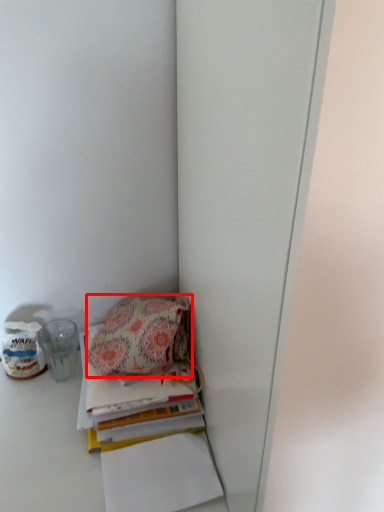
Question: From the image's perspective, what is the correct spatial positioning of handbag (annotated by the red box) in reference to paperback book?

Choices:
 (A) below
 (B) above

Answer: (B)